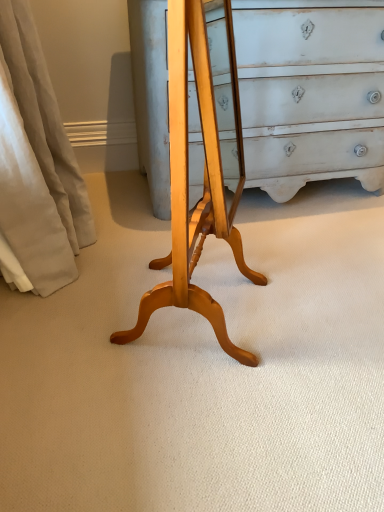
Question: From the image's perspective, relative to light wood changing table at center, is beige fabric curtain at left above or below?

Choices:
 (A) above
 (B) below

Answer: (A)

Question: Looking at their shapes, would you say beige fabric curtain at left is wider or thinner than light wood changing table at center?

Choices:
 (A) wide
 (B) thin

Answer: (A)

Question: Which is correct: beige fabric curtain at left is inside light wood changing table at center, or outside of it?

Choices:
 (A) inside
 (B) outside

Answer: (B)

Question: Do you think light wood changing table at center is within beige fabric curtain at left, or outside of it?

Choices:
 (A) inside
 (B) outside

Answer: (B)

Question: Is light wood changing table at center in front of or behind beige fabric curtain at left in the image?

Choices:
 (A) front
 (B) behind

Answer: (A)

Question: Looking at their shapes, would you say light wood changing table at center is wider or thinner than beige fabric curtain at left?

Choices:
 (A) wide
 (B) thin

Answer: (B)

Question: Is light wood changing table at center bigger or smaller than beige fabric curtain at left?

Choices:
 (A) big
 (B) small

Answer: (B)